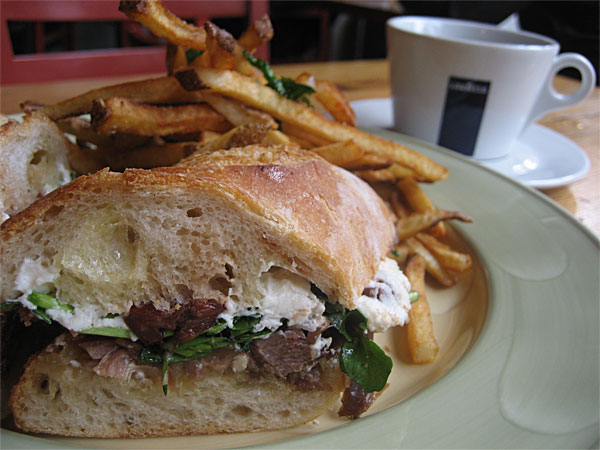
Locate an element on the screen. This screenshot has height=450, width=600. white plate is located at coordinates (536, 305).